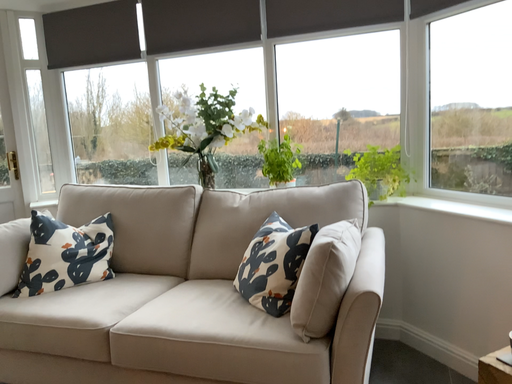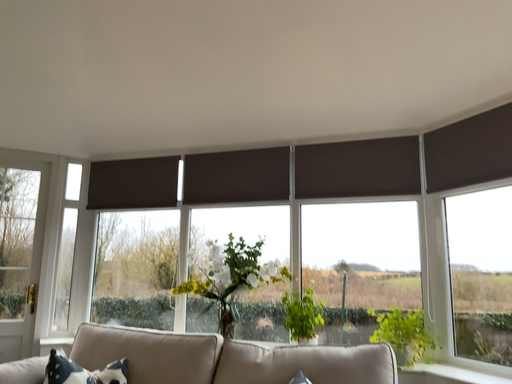
Question: How did the camera likely rotate when shooting the video?

Choices:
 (A) rotated downward
 (B) rotated upward

Answer: (B)